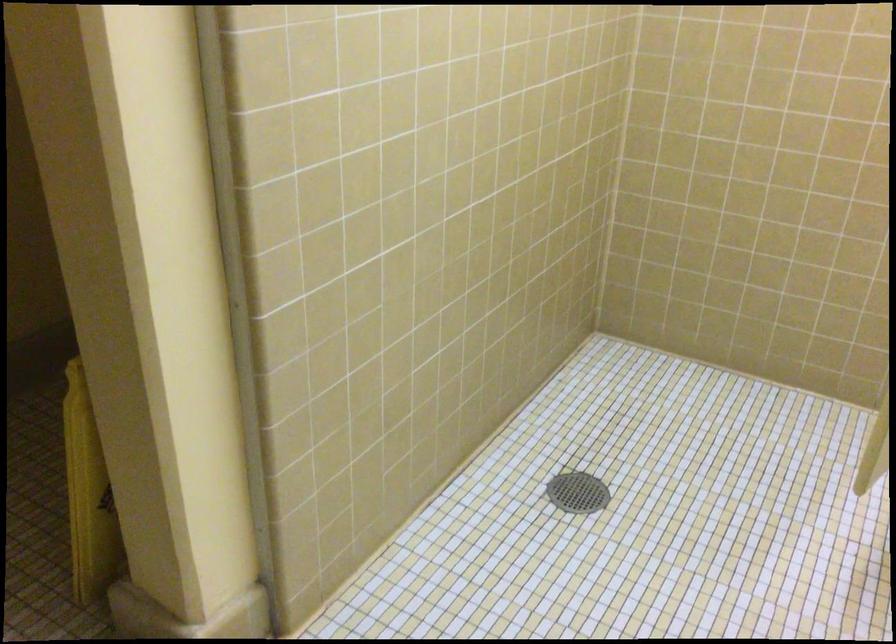
Based on the continuous images, in which direction is the camera rotating?

The rotation direction of the camera is left-down.